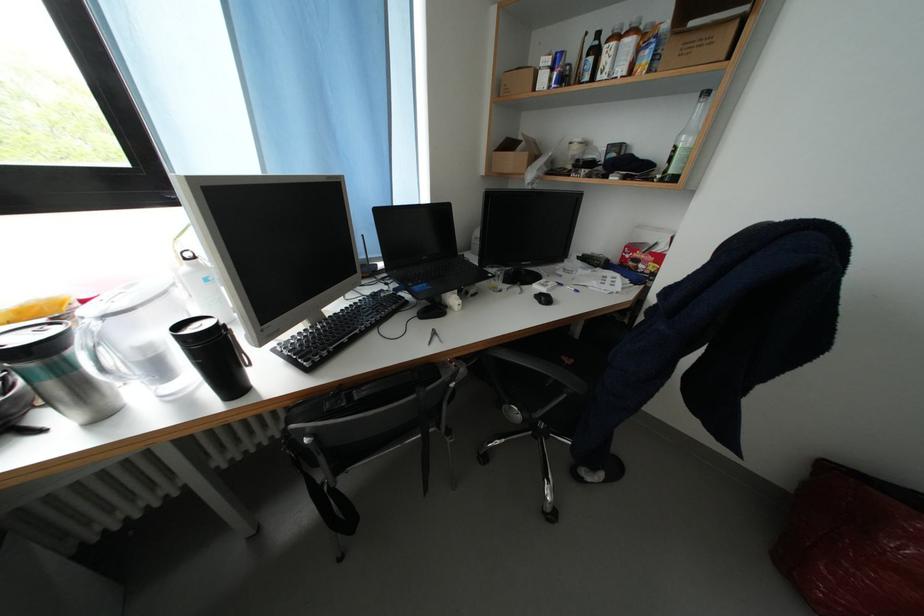
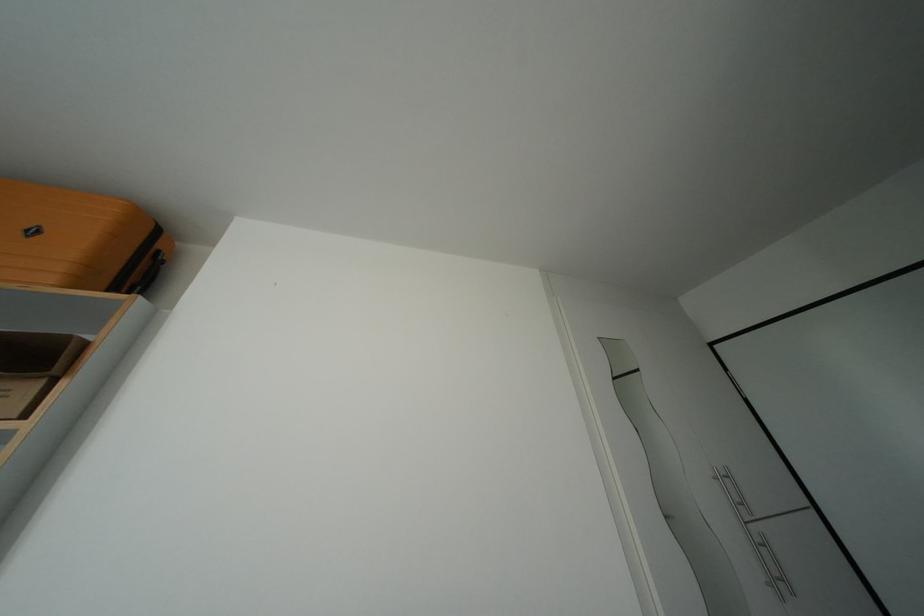
The first image is from the beginning of the video and the second image is from the end. How did the camera likely rotate when shooting the video?

The rotation direction of the camera is right-up.